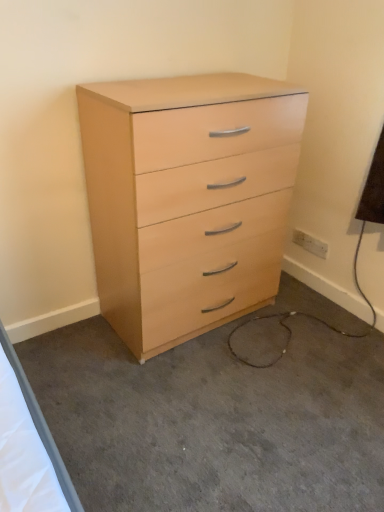
The image size is (384, 512). In order to click on free spot to the right of light wood/finish chest of drawers at center in this screenshot , I will do `click(307, 335)`.